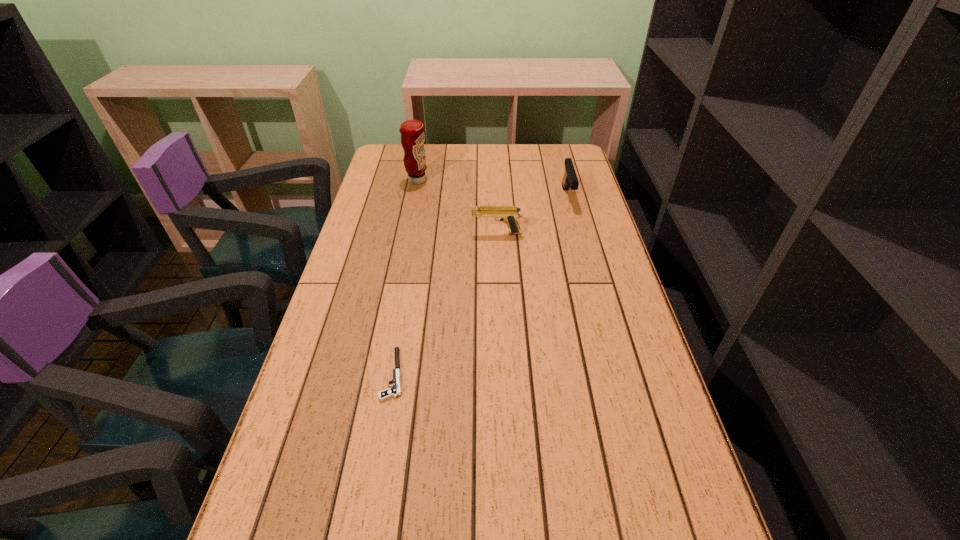
Where is `free space at the left edge`? free space at the left edge is located at coordinates (378, 202).

Image resolution: width=960 pixels, height=540 pixels. Find the location of `free space at the right edge of the desktop`. free space at the right edge of the desktop is located at coordinates coord(594,352).

Identify the location of blank region between the third farthest object and the leftmost pistol. The height and width of the screenshot is (540, 960). (445, 303).

At what (x,y) coordinates should I click in order to perform the action: click on free space between the tallest object and the rightmost object. Please return your answer as a coordinate pair (x, y). Looking at the image, I should click on (492, 188).

At what (x,y) coordinates should I click in order to perform the action: click on free space between the third object from left to right and the condiment. Please return your answer as a coordinate pair (x, y). This screenshot has height=540, width=960. Looking at the image, I should click on (457, 207).

What are the coordinates of `free area in between the leftmost pistol and the second pistol from right to left` in the screenshot? It's located at (445, 303).

Find the location of a particular element. This screenshot has width=960, height=540. vacant area that lies between the shortest pistol and the condiment is located at coordinates (405, 277).

Where is `vacant area that lies between the nearest object and the condiment`? The width and height of the screenshot is (960, 540). vacant area that lies between the nearest object and the condiment is located at coordinates (405, 277).

This screenshot has width=960, height=540. What are the coordinates of `free spot between the rightmost object and the tallest object` in the screenshot? It's located at (492, 188).

Identify the location of free spot between the farthest pistol and the second pistol from right to left. The image size is (960, 540). (532, 215).